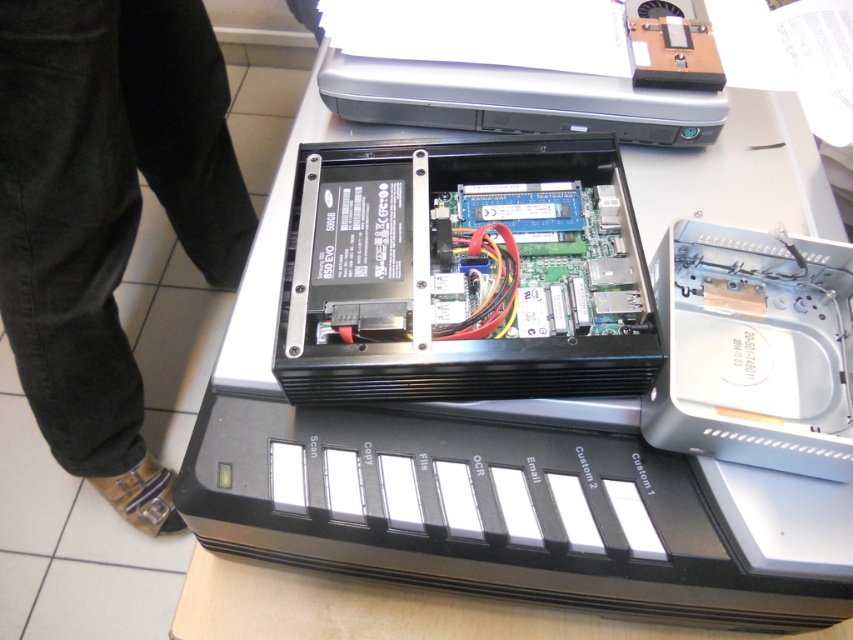
You are organizing a workspace and need to move the black corduroy pants at lower center and the satin silver printer at upper center. Based on their current positions, which object is closer to you?

The black corduroy pants at lower center is closer to you because it is in front of the satin silver printer at upper center.

You are organizing a tech repair event and need to place the black corduroy pants at lower center and the satin silver printer at upper center on a shelf. Which object should you place first to ensure proper stacking?

The satin silver printer at upper center should be placed first on the shelf since the black corduroy pants at lower center is located below it in the original image, implying it needs to be positioned lower in the stack.

You are organizing a storage space and need to decide which item to place first. Since you want to put the larger item into the storage first, which one should you choose between the black corduroy pants at lower center and the satin silver printer at upper center?

The black corduroy pants at lower center is bigger than the satin silver printer at upper center, so you should place the black corduroy pants at lower center first.